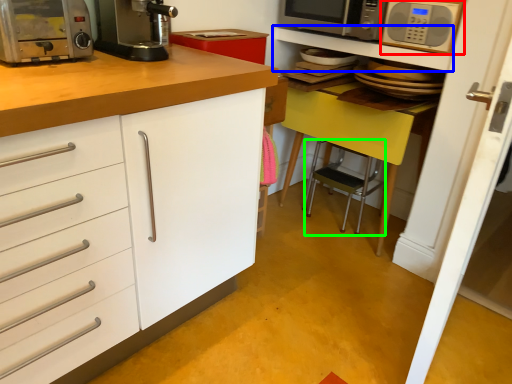
Question: Which is farther away from microwave oven (highlighted by a red box)? shelf (highlighted by a blue box) or step stool (highlighted by a green box)?

Choices:
 (A) shelf
 (B) step stool

Answer: (B)